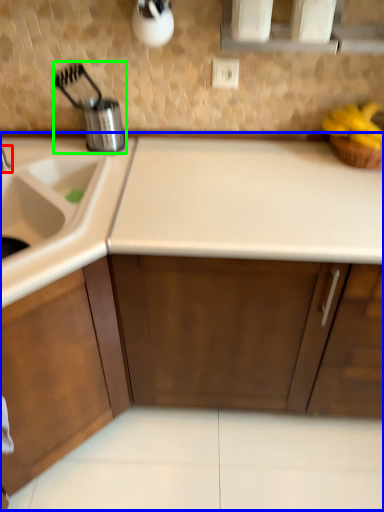
Question: Estimate the real-world distances between objects in this image. Which object is farther from tap (highlighted by a red box), countertop (highlighted by a blue box) or appliance (highlighted by a green box)?

Choices:
 (A) countertop
 (B) appliance

Answer: (A)